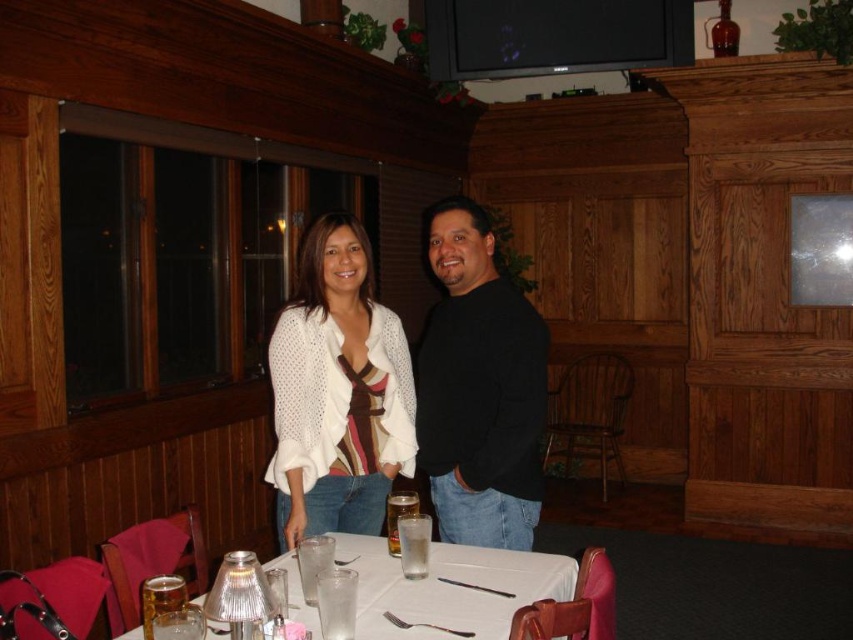
Does white knit cardigan at center have a greater width compared to white glossy table at center?

No, white knit cardigan at center is not wider than white glossy table at center.

Is white knit cardigan at center smaller than white glossy table at center?

Incorrect, white knit cardigan at center is not smaller in size than white glossy table at center.

This screenshot has width=853, height=640. What do you see at coordinates (337, 392) in the screenshot?
I see `white knit cardigan at center` at bounding box center [337, 392].

Image resolution: width=853 pixels, height=640 pixels. What are the coordinates of `white knit cardigan at center` in the screenshot? It's located at (337, 392).

Can you confirm if black matte sweater at center is positioned to the right of white glossy table at center?

Correct, you'll find black matte sweater at center to the right of white glossy table at center.

Looking at this image, which is above, black matte sweater at center or white glossy table at center?

black matte sweater at center

Does point (445, 298) come in front of point (393, 577)?

No, (445, 298) is further to viewer.

The height and width of the screenshot is (640, 853). I want to click on black matte sweater at center, so tap(479, 388).

Consider the image. Is white knit cardigan at center further to camera compared to black matte sweater at center?

Yes, it is behind black matte sweater at center.

Is white knit cardigan at center above black matte sweater at center?

Incorrect, white knit cardigan at center is not positioned above black matte sweater at center.

I want to click on white knit cardigan at center, so click(x=337, y=392).